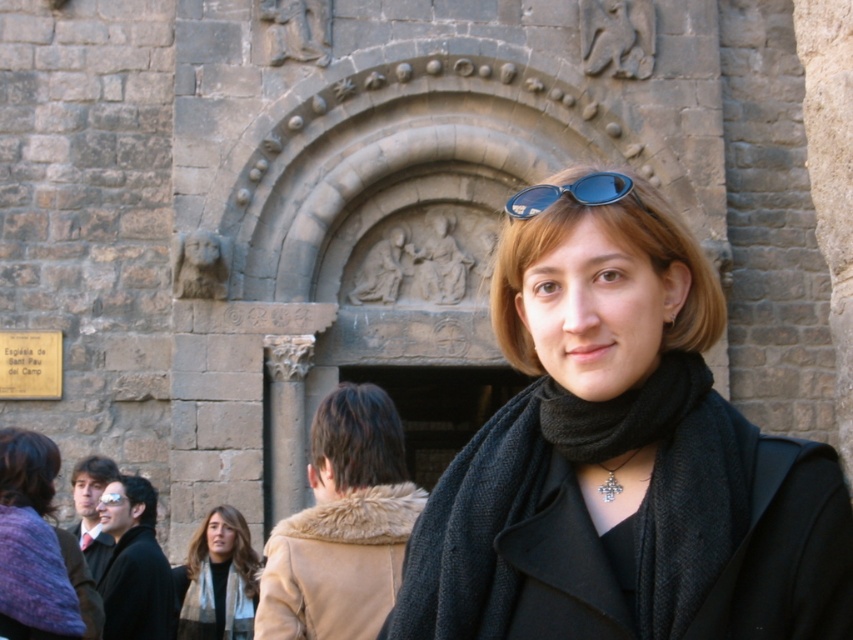
Who is more distant from viewer, (695,289) or (253,600)?

Positioned behind is point (253,600).

You are a GUI agent. You are given a task and a screenshot of the screen. Output one action in this format:
    pyautogui.click(x=<x>, y=<y>)
    Task: Click on the black matte scarf at center
    This screenshot has height=640, width=853.
    Given the screenshot: What is the action you would take?
    pyautogui.click(x=619, y=244)

At what (x,y) coordinates should I click in order to perform the action: click on black matte scarf at center. Please return your answer as a coordinate pair (x, y). The width and height of the screenshot is (853, 640). Looking at the image, I should click on (619, 244).

Does blue reflective lenses at upper center have a lesser height compared to matte black goggles at center?

Incorrect, blue reflective lenses at upper center's height does not fall short of matte black goggles at center's.

Describe the element at coordinates (569, 193) in the screenshot. I see `blue reflective lenses at upper center` at that location.

Image resolution: width=853 pixels, height=640 pixels. Identify the location of blue reflective lenses at upper center. (569, 193).

Can you confirm if black matte scarf at center is smaller than matte black goggles at center?

Actually, black matte scarf at center might be larger than matte black goggles at center.

Is point (680, 241) positioned after point (113, 499)?

No, (680, 241) is closer to viewer.

You are a GUI agent. You are given a task and a screenshot of the screen. Output one action in this format:
    pyautogui.click(x=<x>, y=<y>)
    Task: Click on the black matte scarf at center
    
    Given the screenshot: What is the action you would take?
    pyautogui.click(x=619, y=244)